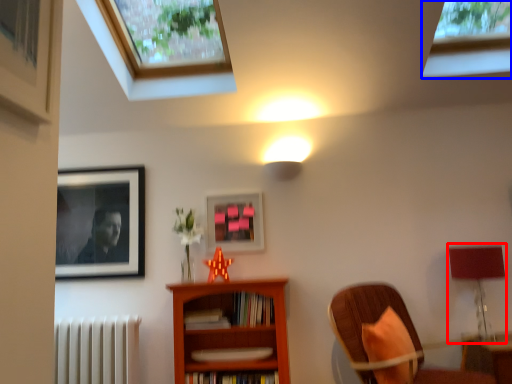
Question: Which object appears closest to the camera in this image, table lamp (highlighted by a red box) or window (highlighted by a blue box)?

Choices:
 (A) table lamp
 (B) window

Answer: (B)